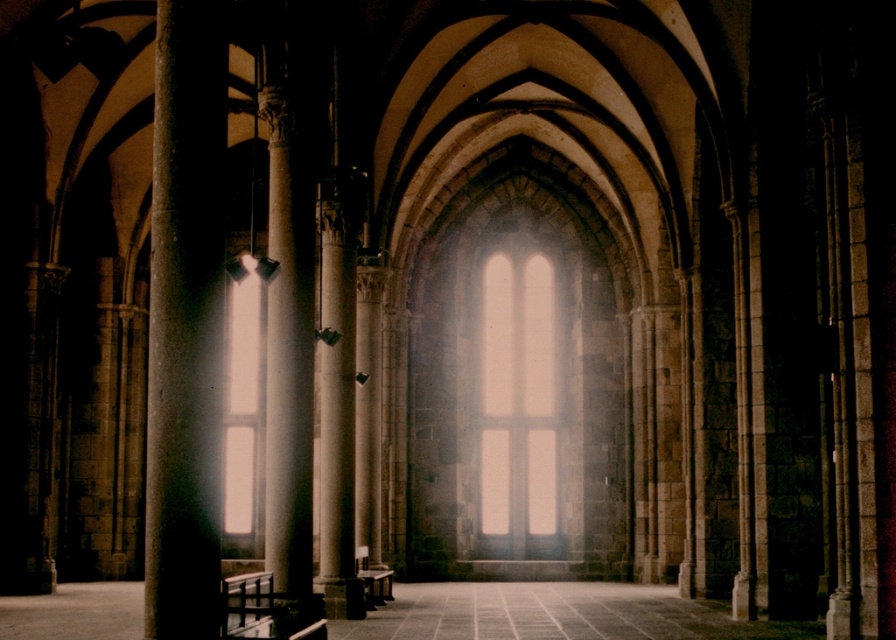
Describe the element at coordinates (185, 321) in the screenshot. I see `smooth stone pillar at left` at that location.

What are the coordinates of `smooth stone pillar at left` in the screenshot? It's located at (185, 321).

Describe the element at coordinates (289, 340) in the screenshot. I see `white marble column at center` at that location.

Who is more forward, (297, 588) or (524, 323)?

Positioned in front is point (297, 588).

Does point (276, 232) come farther from viewer compared to point (479, 440)?

No.

You are a GUI agent. You are given a task and a screenshot of the screen. Output one action in this format:
    pyautogui.click(x=<x>, y=<y>)
    Task: Click on the white marble column at center
    The image size is (896, 640).
    Given the screenshot: What is the action you would take?
    pyautogui.click(x=289, y=340)

Is smooth stone pillar at left below translucent glass window at center?

Actually, smooth stone pillar at left is above translucent glass window at center.

Which is more to the right, smooth stone pillar at left or translucent glass window at center?

Positioned to the right is translucent glass window at center.

Does point (149, 602) come farther from viewer compared to point (517, 436)?

No, it is not.

The height and width of the screenshot is (640, 896). What are the coordinates of `smooth stone pillar at left` in the screenshot? It's located at (185, 321).